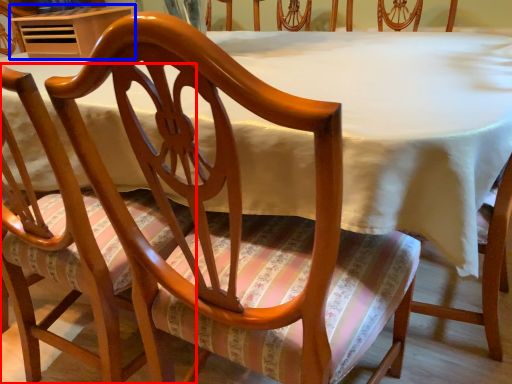
Question: Which object appears farthest to the camera in this image, chair (highlighted by a red box) or table (highlighted by a blue box)?

Choices:
 (A) chair
 (B) table

Answer: (B)